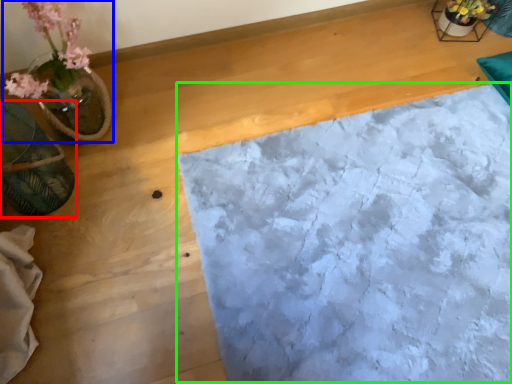
Question: Which is farther away from flowerpot (highlighted by a red box)? houseplant (highlighted by a blue box) or sheet (highlighted by a green box)?

Choices:
 (A) houseplant
 (B) sheet

Answer: (B)